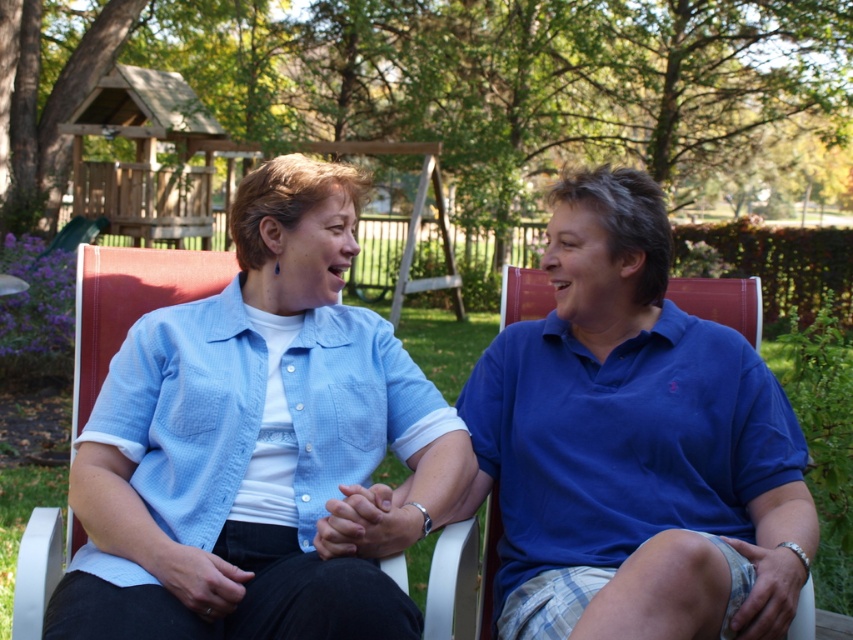
You are a photographer trying to capture a portrait of both individuals. Since you want to ensure both subjects are framed properly, which direction should you adjust your camera to focus on the light blue fabric shirt at center first before the blue cotton polo shirt at center?

You should adjust your camera to the left to focus on the light blue fabric shirt at center first since it is positioned to the left of the blue cotton polo shirt at center.

You are a photographer trying to capture both the light blue fabric shirt at center and the blue cotton polo shirt at center in a single frame. Based on their positions, which shirt should you focus on first to ensure both are in the shot?

You should focus on the light blue fabric shirt at center first because the blue cotton polo shirt at center is behind it, so ensuring the front shirt is properly framed will help include the one behind.

You are a photographer trying to capture a closeup shot of both the light blue fabric shirt at center and the blue cotton polo shirt at center. Your camera has a maximum focus range of 18 inches. Can you capture both shirts in focus without moving the camera or the subjects?

The light blue fabric shirt at center and blue cotton polo shirt at center are 19.18 inches apart. Since this distance exceeds the camera maximum focus range of 18 inches, you cannot capture both shirts in focus without adjusting the camera or moving the subjects.